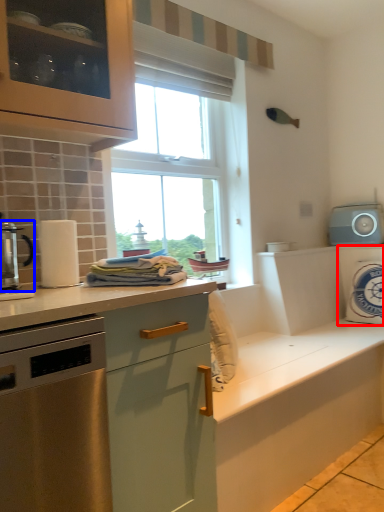
Question: Which object is further to the camera taking this photo, appliance (highlighted by a red box) or kitchen appliance (highlighted by a blue box)?

Choices:
 (A) appliance
 (B) kitchen appliance

Answer: (A)